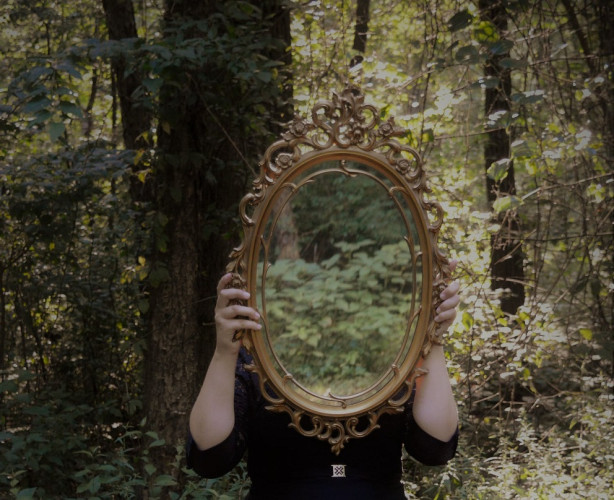
Where is `mirror`? mirror is located at coordinates (324, 312).